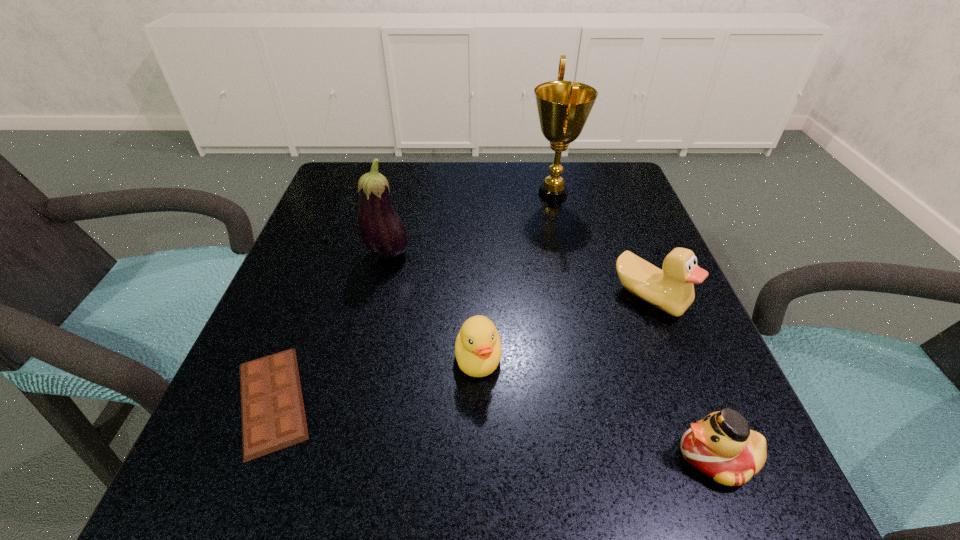
This screenshot has width=960, height=540. Find the location of `vacant region that satisfies the following two spatial constraints: 1. on the front view with handles of the award; 2. at the beak of the leftmost duck`. vacant region that satisfies the following two spatial constraints: 1. on the front view with handles of the award; 2. at the beak of the leftmost duck is located at coordinates (589, 358).